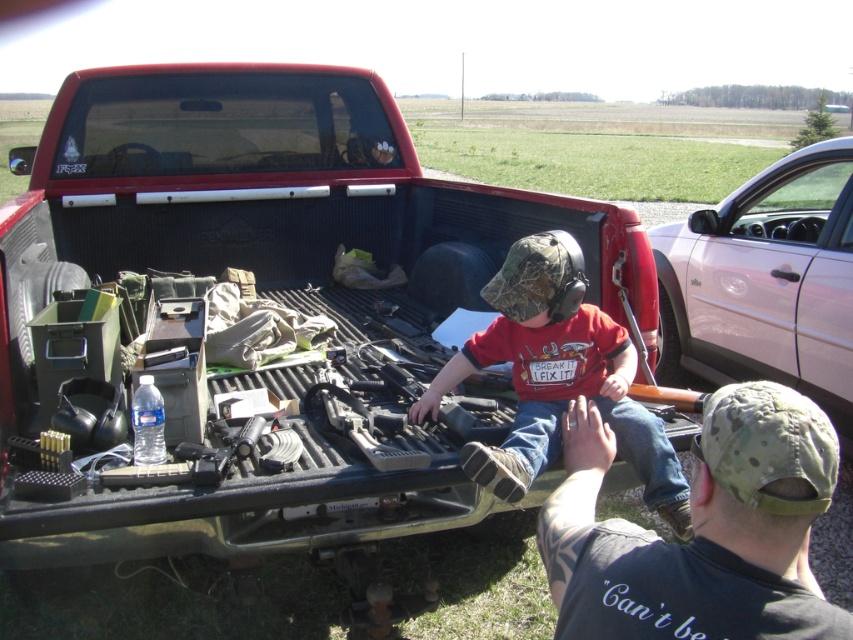
You are a fashion designer observing the camouflage fabric cap at upper right and the camouflage fabric shirt at center. Which item has a smaller size?

The camouflage fabric cap at upper right has a smaller size compared to the camouflage fabric shirt at center.

You are a photographer trying to capture a clear photo of both the metallic silver car at right and the camouflage fabric shirt at center. Since you can only focus on one object at a time, which object should you focus on to ensure the other is still somewhat in focus?

You should focus on the camouflage fabric shirt at center because it is closer to you than the metallic silver car at right, so focusing on the closer object will keep the farther one more in focus.